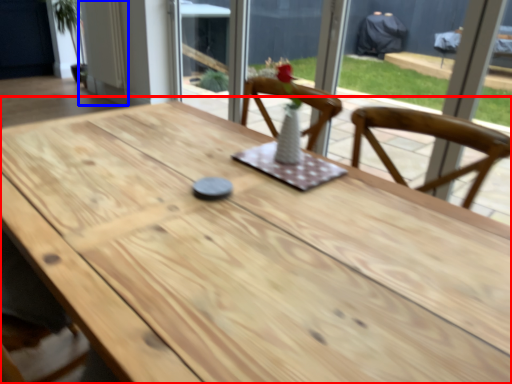
Question: Which of the following is the closest to the observer, table (highlighted by a red box) or door (highlighted by a blue box)?

Choices:
 (A) table
 (B) door

Answer: (A)